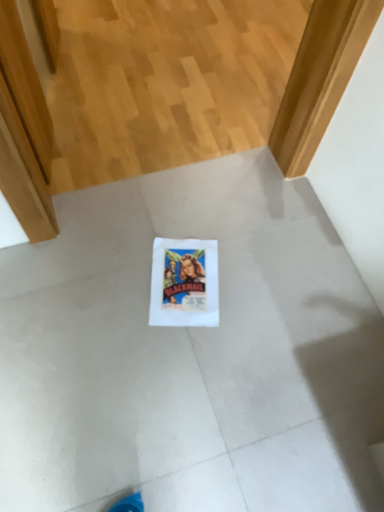
At what (x,y) coordinates should I click in order to perform the action: click on unoccupied space behind white paper flyer at center. Please return your answer as a coordinate pair (x, y). The height and width of the screenshot is (512, 384). Looking at the image, I should click on (194, 213).